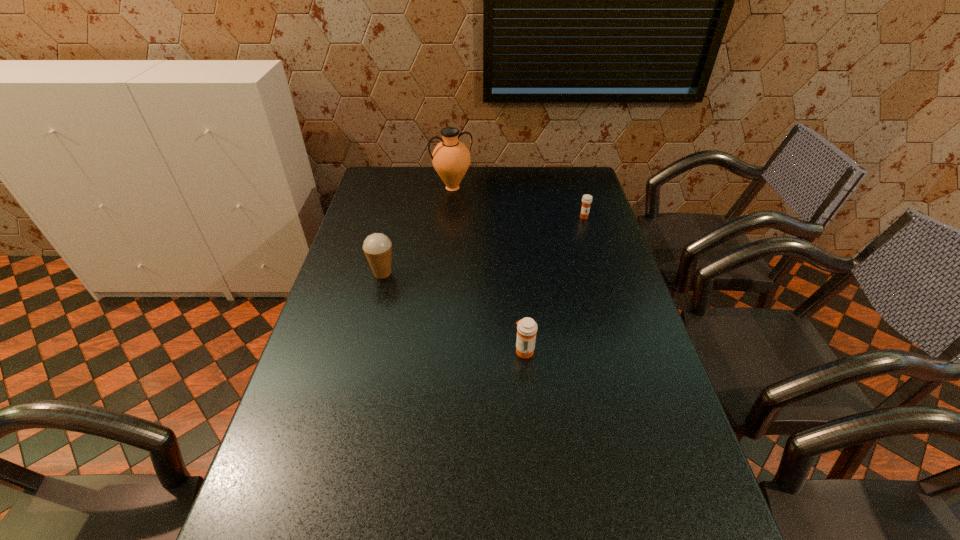
Where is `the tallest object`? The image size is (960, 540). the tallest object is located at coordinates (451, 159).

Find the location of a particular element. The image size is (960, 540). the farthest object is located at coordinates (451, 159).

The image size is (960, 540). I want to click on the second tallest object, so click(x=377, y=247).

Where is `the second nearest object`? This screenshot has width=960, height=540. the second nearest object is located at coordinates (377, 247).

Find the location of a particular element. the taller medicine is located at coordinates (527, 328).

You are a GUI agent. You are given a task and a screenshot of the screen. Output one action in this format:
    pyautogui.click(x=<x>, y=<y>)
    Task: Click on the second shortest object
    This screenshot has width=960, height=540.
    Given the screenshot: What is the action you would take?
    pyautogui.click(x=527, y=328)

Identify the location of the second farthest object. (586, 199).

I want to click on the rightmost object, so click(586, 199).

You are a GUI agent. You are given a task and a screenshot of the screen. Output one action in this format:
    pyautogui.click(x=<x>, y=<y>)
    Task: Click on the free location located 0.070m on the right of the pitcher
    
    Given the screenshot: What is the action you would take?
    pyautogui.click(x=491, y=188)

You are a GUI agent. You are given a task and a screenshot of the screen. Output one action in this format:
    pyautogui.click(x=<x>, y=<y>)
    Task: Click on the blank area located 0.110m on the back of the second nearest object
    The width and height of the screenshot is (960, 540).
    Given the screenshot: What is the action you would take?
    pyautogui.click(x=390, y=244)